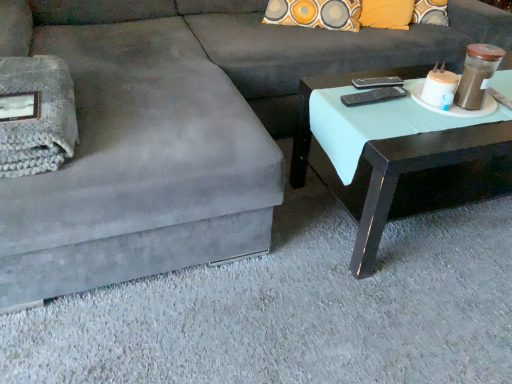
The width and height of the screenshot is (512, 384). Find the location of `vacant space in front of black plastic remote at upper right, which appears as the 2th remote when ordered from the bottom`. vacant space in front of black plastic remote at upper right, which appears as the 2th remote when ordered from the bottom is located at coordinates (390, 103).